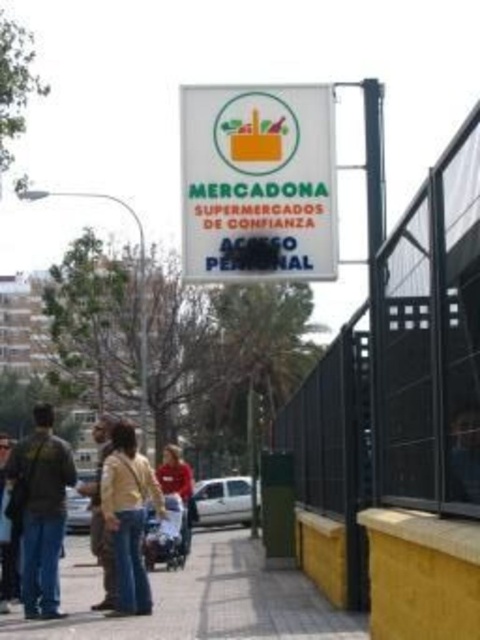
You are standing on the sidewalk in front of the Mercadona store and want to place two markers at the coordinates point [155,577] and point [191,522]. Which marker will be closer to you?

Point [155,577] is closer to the viewer than point [191,522], so the marker at point [155,577] will be closer to you.

You are a fashion designer observing the street scene. You notice the dark brown leather jacket at left and the red cotton shirt at center. Which clothing item takes up more visual space in the image?

The red cotton shirt at center occupies more visual space than the dark brown leather jacket at left, as the dark brown leather jacket at left occupies less space than red cotton shirt at center.

In the scene shown: You are standing on the sidewalk in front of the Mercadona store and need to reach the jeans at lower left. The yellow cotton shirt at center is blocking your path. Can you walk around it without getting too close? The minimum safe distance you can pass is 2 meters.

The distance between the yellow cotton shirt at center and jeans at lower left is 11.07 meters. Since the minimum safe distance required is 2 meters, you can easily walk around the yellow cotton shirt at center while maintaining a safe distance of 2 meters or more.